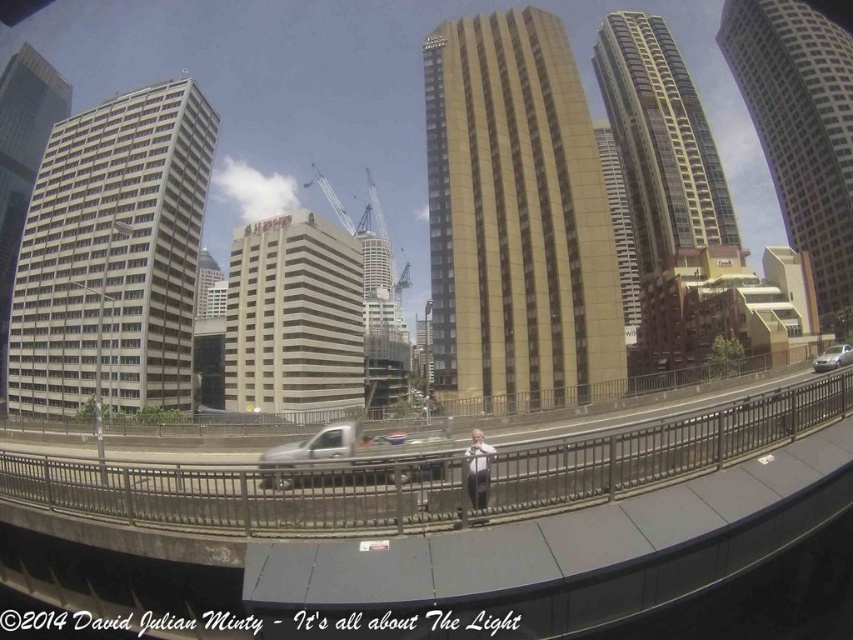
You are standing at the viewpoint where the image was taken. There are two points marked in the scene, point A at coordinates point (376, 566) and point B at coordinates point (827, 353). Which point is closer to you?

Point point (376, 566) is closer to the viewer than point point (827, 353).

You are a pedestrian standing on the bridge and see the silver metallic truck at center and the light gray suit at center below. Which object is located to the left when viewed from your position?

The silver metallic truck at center is positioned on the left side of light gray suit at center, so it is located to the left when viewed from your position on the bridge.

You are a pedestrian standing on the bridge and see the silver metallic truck at center and the light gray suit at center. Which object is positioned higher from the ground?

The silver metallic truck at center is located above the light gray suit at center, so it is positioned higher from the ground.